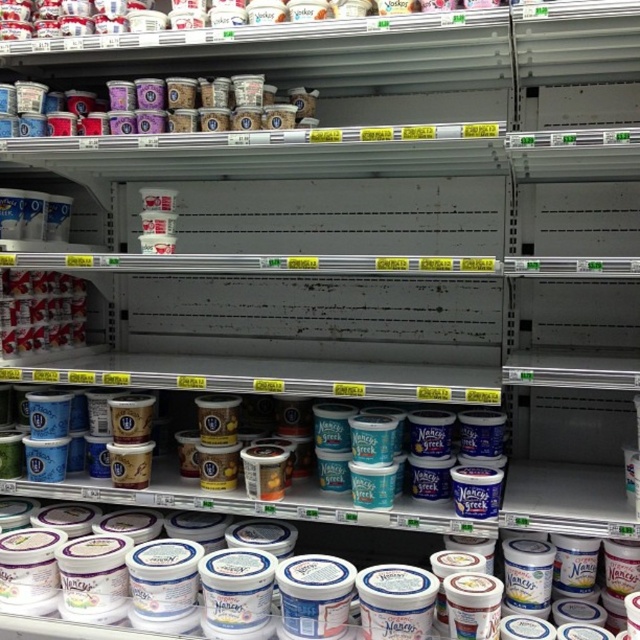
You are a grocery store employee who needs to stack the metallic silver yogurt at left on top of the matte plastic yogurt cups at upper center. Based on their sizes, will this arrangement be possible?

The matte plastic yogurt cups at upper center might be wider than metallic silver yogurt at left, so it is uncertain if the metallic silver yogurt at left will fit on top of them without wobbling.

You are a grocery store employee who needs to stack boxes on the shelf. The boxes are taller than the metallic silver yogurt at left. Can you place them above the matte plastic yogurt cups at upper center?

The matte plastic yogurt cups at upper center is not as tall as metallic silver yogurt at left. Since the boxes are taller than the metallic silver yogurt at left, they would also be taller than the matte plastic yogurt cups at upper center. Therefore, you cannot place the boxes above the matte plastic yogurt cups at upper center because they are too tall.

You are a customer in a grocery store looking at the dairy aisle. You see two points marked on the shelf. Which point is closer to you, point (236, 83) or point (61, 336)?

Point (236, 83) is in front of point (61, 336), so it is closer to you.